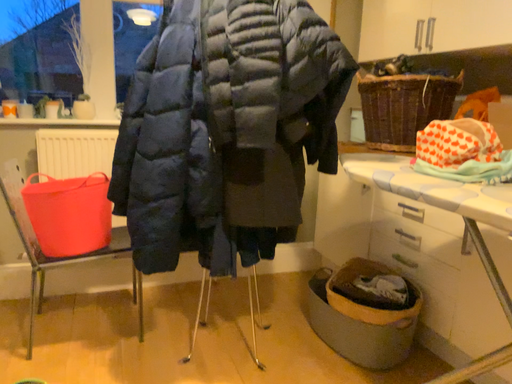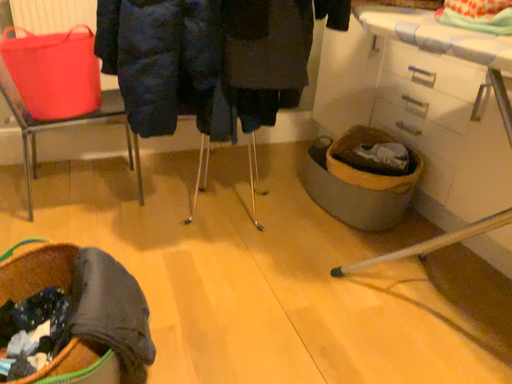
Question: How did the camera likely rotate when shooting the video?

Choices:
 (A) rotated upward
 (B) rotated downward

Answer: (B)